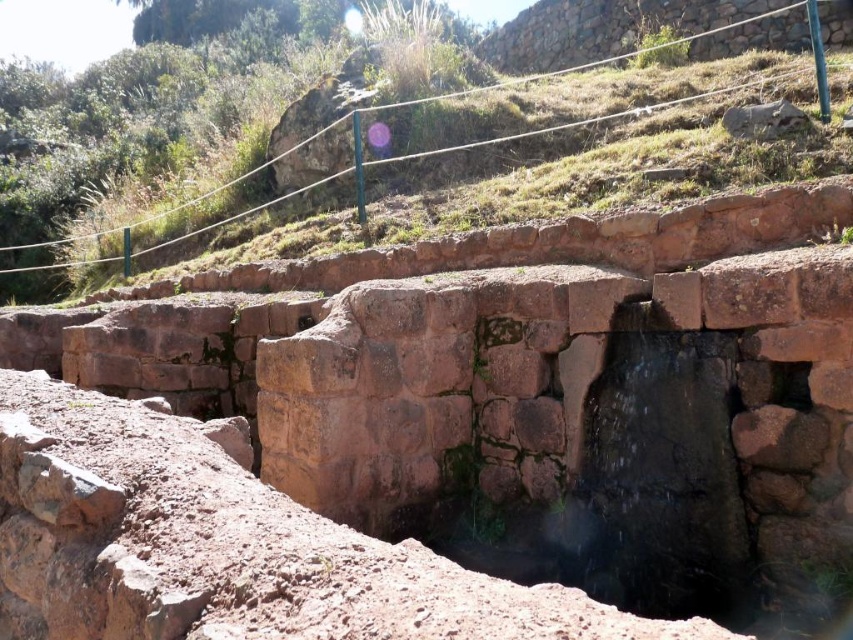
Question: Can you confirm if brown rough stone at center is bigger than brown stone steps at center?

Choices:
 (A) no
 (B) yes

Answer: (A)

Question: Which object is farther from the camera taking this photo?

Choices:
 (A) brown rough stone at center
 (B) brown stone steps at center

Answer: (B)

Question: Which point appears closest to the camera in this image?

Choices:
 (A) (239, 556)
 (B) (532, 148)

Answer: (A)

Question: Is brown rough stone at center thinner than brown stone steps at center?

Choices:
 (A) no
 (B) yes

Answer: (B)

Question: Does brown rough stone at center appear on the right side of brown stone steps at center?

Choices:
 (A) yes
 (B) no

Answer: (A)

Question: Which object is farther from the camera taking this photo?

Choices:
 (A) brown stone steps at center
 (B) brown rough stone at center

Answer: (A)